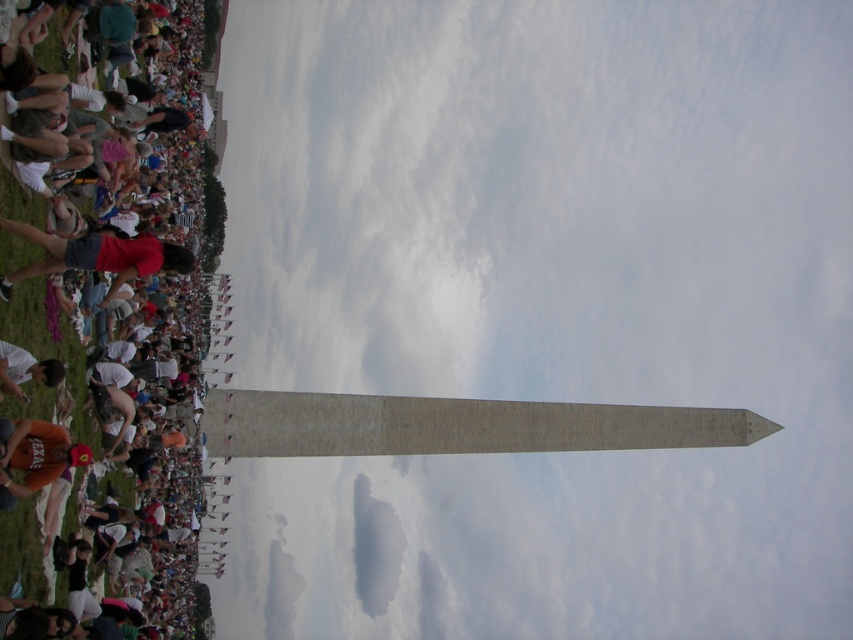
Question: Which of the following is the farthest from the observer?

Choices:
 (A) (41, 374)
 (B) (181, 173)

Answer: (B)

Question: Considering the relative positions of white cotton t-shirts at left and matte black shirt at lower left in the image provided, where is white cotton t-shirts at left located with respect to matte black shirt at lower left?

Choices:
 (A) below
 (B) above

Answer: (B)

Question: Which point is farther to the camera?

Choices:
 (A) white cotton t-shirts at left
 (B) matte black shirt at lower left
 (C) matte red shirt at left

Answer: (A)

Question: Based on their relative distances, which object is nearer to the matte black shirt at lower left?

Choices:
 (A) matte red shirt at left
 (B) white cotton t-shirts at left

Answer: (A)

Question: Is white cotton t-shirts at left wider than matte black shirt at lower left?

Choices:
 (A) yes
 (B) no

Answer: (A)

Question: Considering the relative positions of matte red shirt at left and matte black shirt at lower left in the image provided, where is matte red shirt at left located with respect to matte black shirt at lower left?

Choices:
 (A) left
 (B) right

Answer: (B)